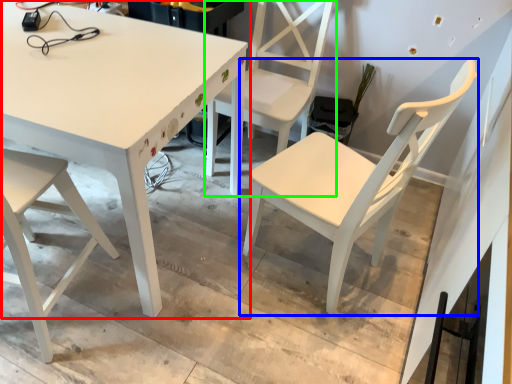
Question: Based on their relative distances, which object is nearer to table (highlighted by a red box)? Choose from chair (highlighted by a blue box) and chair (highlighted by a green box).

Choices:
 (A) chair
 (B) chair

Answer: (B)